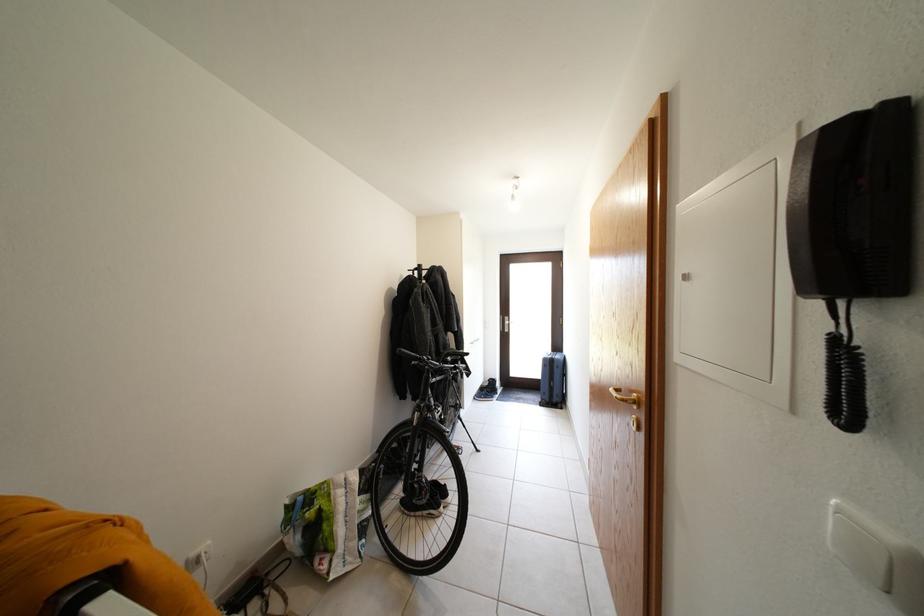
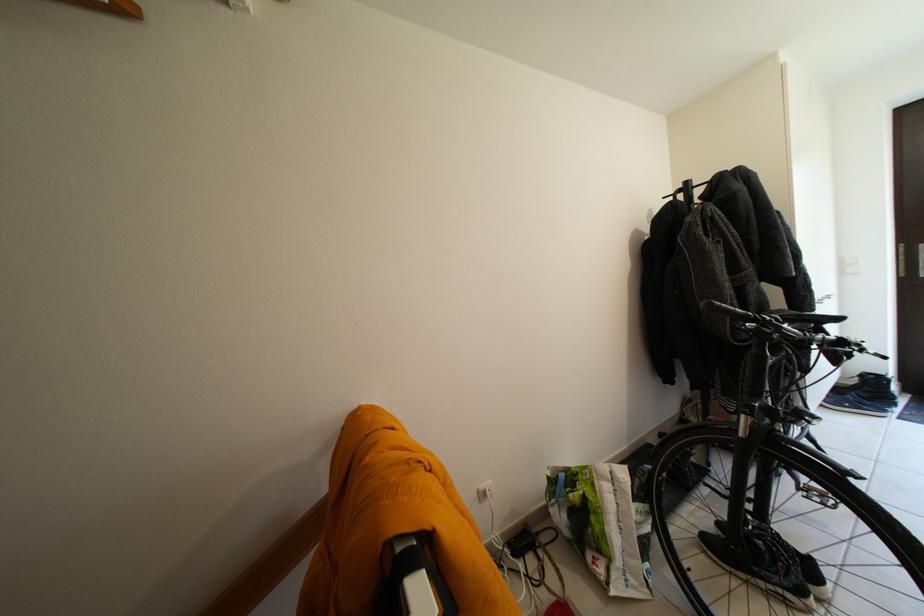
Where in the second image is the point corresponding to (202,559) from the first image?

(490, 493)